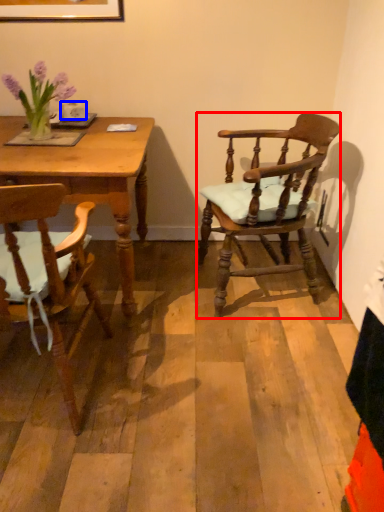
Question: Among these objects, which one is nearest to the camera, chair (highlighted by a red box) or coffee cup (highlighted by a blue box)?

Choices:
 (A) chair
 (B) coffee cup

Answer: (A)